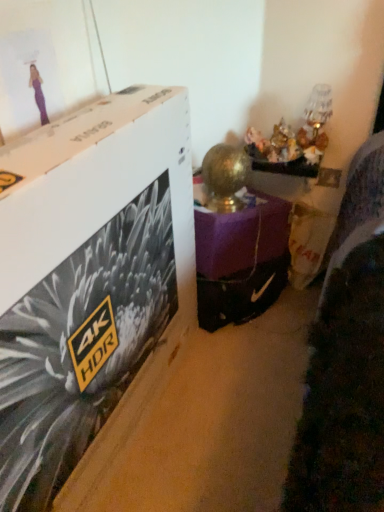
Question: Should I look upward or downward to see white cardboard box at upper left?

Choices:
 (A) down
 (B) up

Answer: (A)

Question: Can you see white cardboard box at upper left touching purple matte lamp at center?

Choices:
 (A) yes
 (B) no

Answer: (B)

Question: Does white cardboard box at upper left have a lesser height compared to purple matte lamp at center?

Choices:
 (A) yes
 (B) no

Answer: (B)

Question: From a real-world perspective, is white cardboard box at upper left below purple matte lamp at center?

Choices:
 (A) no
 (B) yes

Answer: (A)

Question: Is white cardboard box at upper left at the left side of purple matte lamp at center?

Choices:
 (A) yes
 (B) no

Answer: (A)

Question: Is white cardboard box at upper left aimed at purple matte lamp at center?

Choices:
 (A) no
 (B) yes

Answer: (A)

Question: Is white cardboard box at upper left turned away from purple matte lamp at center?

Choices:
 (A) no
 (B) yes

Answer: (A)

Question: From the image's perspective, would you say purple matte lamp at center is positioned over white cardboard box at upper left?

Choices:
 (A) no
 (B) yes

Answer: (B)

Question: Is purple matte lamp at center aimed at white cardboard box at upper left?

Choices:
 (A) no
 (B) yes

Answer: (A)

Question: Is the surface of purple matte lamp at center in direct contact with white cardboard box at upper left?

Choices:
 (A) yes
 (B) no

Answer: (B)

Question: From a real-world perspective, is purple matte lamp at center located higher than white cardboard box at upper left?

Choices:
 (A) yes
 (B) no

Answer: (B)

Question: Does purple matte lamp at center have a lesser width compared to white cardboard box at upper left?

Choices:
 (A) no
 (B) yes

Answer: (A)

Question: From a real-world perspective, is purple matte lamp at center located beneath white cardboard box at upper left?

Choices:
 (A) yes
 (B) no

Answer: (A)

Question: From the image's perspective, is white cardboard box at upper left positioned above or below purple matte lamp at center?

Choices:
 (A) above
 (B) below

Answer: (B)